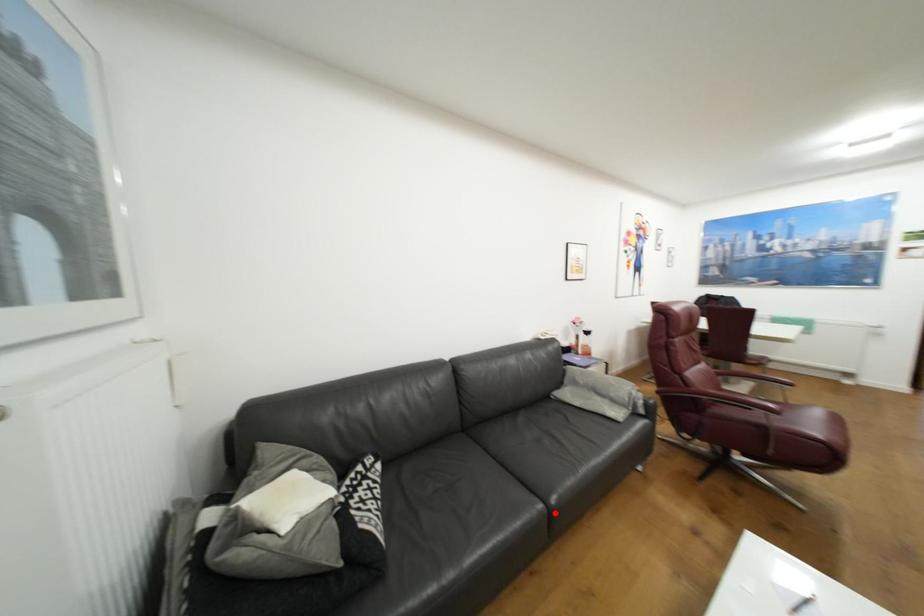
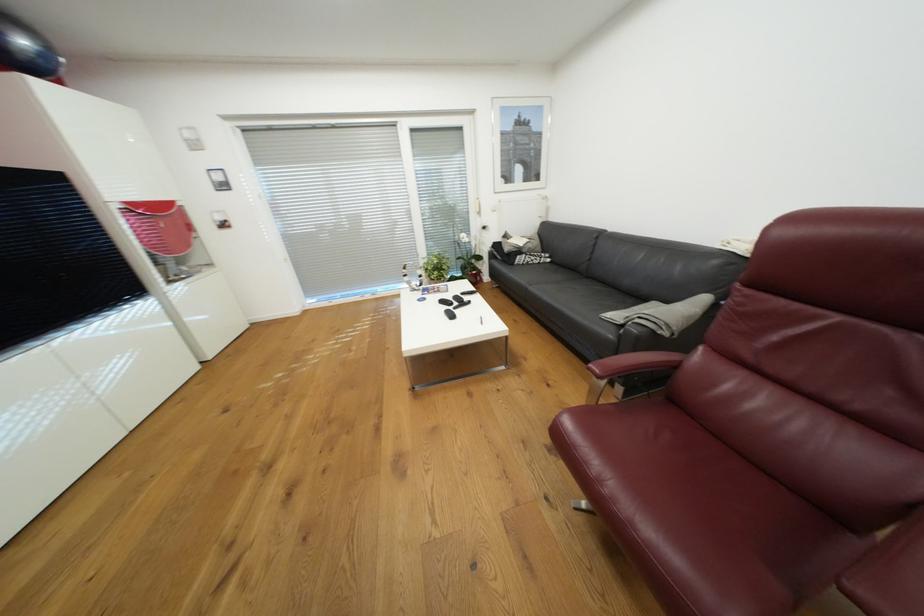
Question: I am providing you with two images of the same scene from different viewpoints. Image1 has a red point marked. In image2, the corresponding 3D location appears at what relative position? Reply with the corresponding letter.

Choices:
 (A) Closer
 (B) Farther

Answer: (A)